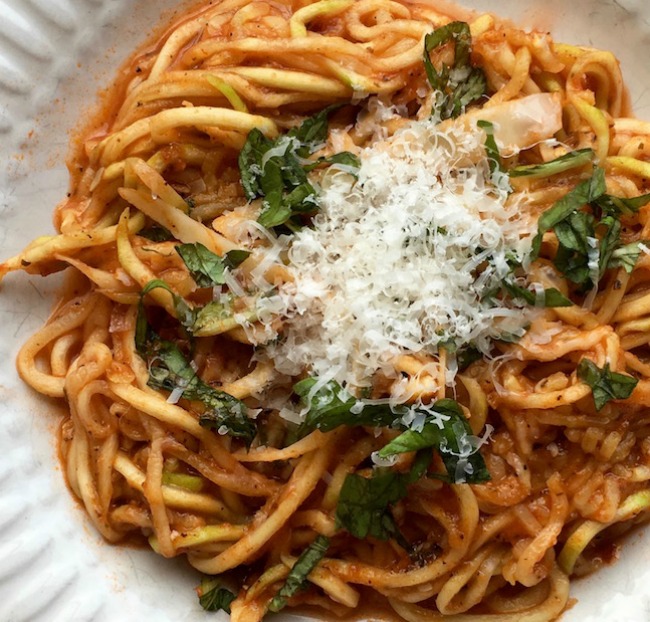
Where is `plate`? plate is located at coordinates (84, 80).